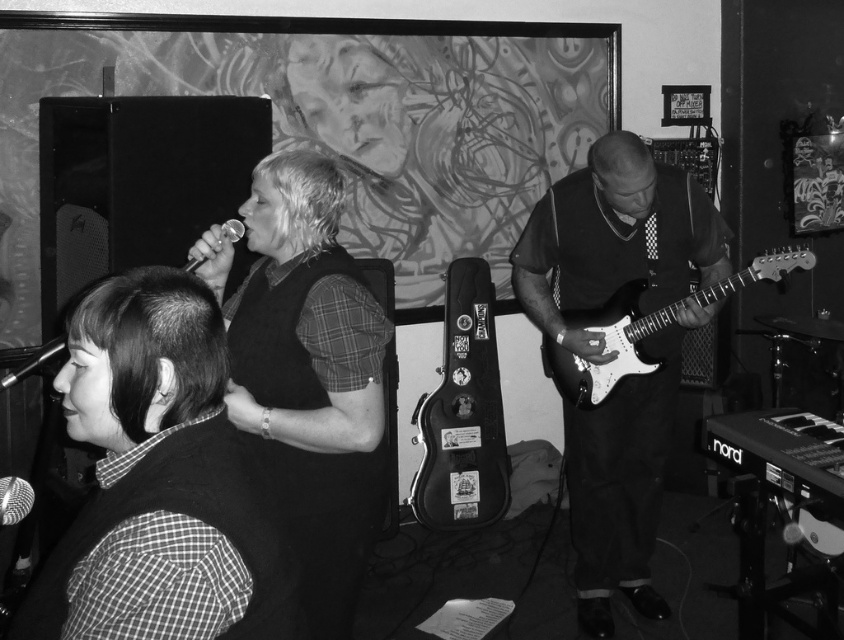
Can you confirm if matte black guitar at center is positioned below white glossy electric guitar at right?

Yes, matte black guitar at center is below white glossy electric guitar at right.

Who is shorter, matte black guitar at center or white glossy electric guitar at right?

white glossy electric guitar at right is shorter.

You are a GUI agent. You are given a task and a screenshot of the screen. Output one action in this format:
    pyautogui.click(x=<x>, y=<y>)
    Task: Click on the matte black guitar at center
    The image size is (844, 640).
    Given the screenshot: What is the action you would take?
    pyautogui.click(x=614, y=240)

Where is `matte black guitar at center`? matte black guitar at center is located at coordinates (614, 240).

Is matte black guitar at center in front of black leather guitar case at center?

Yes, it is in front of black leather guitar case at center.

Does matte black guitar at center appear on the left side of black leather guitar case at center?

In fact, matte black guitar at center is to the right of black leather guitar case at center.

Is point (695, 237) farther from camera compared to point (442, 349)?

No, it is not.

Where is `matte black guitar at center`? matte black guitar at center is located at coordinates (614, 240).

Between checkered fabric shirt at left and black leather guitar case at center, which one has less height?

With less height is checkered fabric shirt at left.

Between checkered fabric shirt at left and black leather guitar case at center, which one is positioned higher?

Positioned higher is checkered fabric shirt at left.

Between point (212, 296) and point (437, 520), which one is positioned behind?

The point (437, 520) is more distant.

This screenshot has width=844, height=640. I want to click on checkered fabric shirt at left, so click(x=161, y=444).